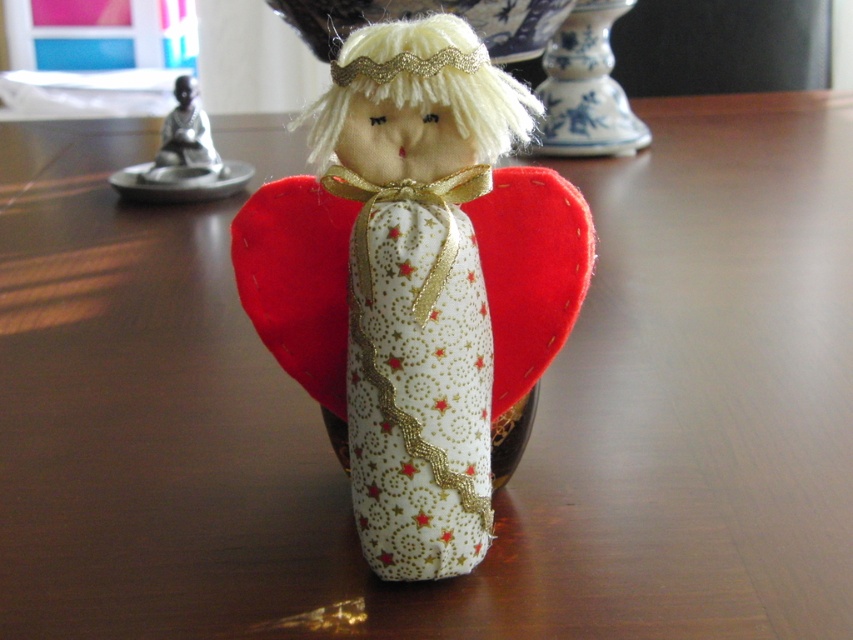
Is white fabric doll at center to the left of brushed metal statue at upper left from the viewer's perspective?

Incorrect, white fabric doll at center is not on the left side of brushed metal statue at upper left.

Who is positioned more to the left, white fabric doll at center or brushed metal statue at upper left?

Positioned to the left is brushed metal statue at upper left.

Who is more forward, (419, 106) or (216, 161)?

Point (419, 106) is in front.

This screenshot has height=640, width=853. What are the coordinates of `white fabric doll at center` in the screenshot? It's located at point(409,280).

Can you confirm if red felt heart at center is positioned above brushed metal statue at upper left?

Incorrect, red felt heart at center is not positioned above brushed metal statue at upper left.

Does red felt heart at center appear on the right side of brushed metal statue at upper left?

Yes, red felt heart at center is to the right of brushed metal statue at upper left.

This screenshot has width=853, height=640. Identify the location of red felt heart at center. (297, 280).

Is white fabric doll at center above red felt heart at center?

Incorrect, white fabric doll at center is not positioned above red felt heart at center.

Based on the photo, how far apart are white fabric doll at center and red felt heart at center?

A distance of 1.69 inches exists between white fabric doll at center and red felt heart at center.

Does point (445, 541) lie in front of point (248, 262)?

Yes, point (445, 541) is in front of point (248, 262).

Where is `white fabric doll at center`? The height and width of the screenshot is (640, 853). white fabric doll at center is located at coordinates (409, 280).